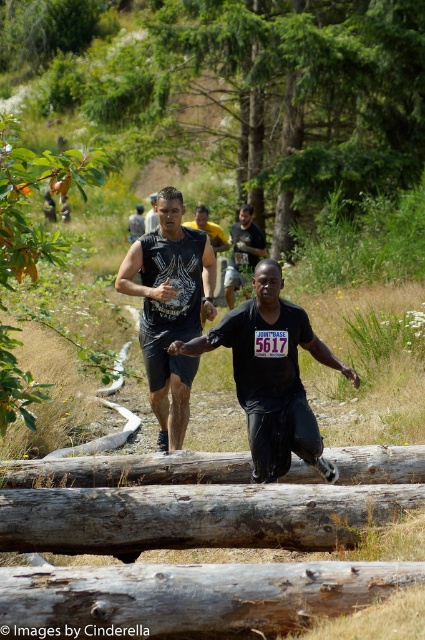
Is weathered brown log at center below matte black tank top at center?

Indeed, weathered brown log at center is positioned under matte black tank top at center.

Between point (141, 593) and point (187, 225), which one is positioned in front?

Positioned in front is point (141, 593).

Is point (121, 595) positioned after point (195, 218)?

No, (121, 595) is closer to viewer.

Image resolution: width=425 pixels, height=640 pixels. What are the coordinates of `weathered brown log at center` in the screenshot? It's located at (189, 596).

Does weathered brown log at center appear over black matte tank top at center?

No.

Between point (13, 586) and point (195, 241), which one is positioned in front?

Point (13, 586) is in front.

The image size is (425, 640). What are the coordinates of `weathered brown log at center` in the screenshot? It's located at (189, 596).

Does black matte shirt at center have a lesser width compared to matte black tank top at center?

Yes.

Can you confirm if black matte shirt at center is wider than matte black tank top at center?

No.

Is point (248, 353) less distant than point (210, 230)?

That is True.

The height and width of the screenshot is (640, 425). What are the coordinates of `black matte shirt at center` in the screenshot? It's located at (272, 374).